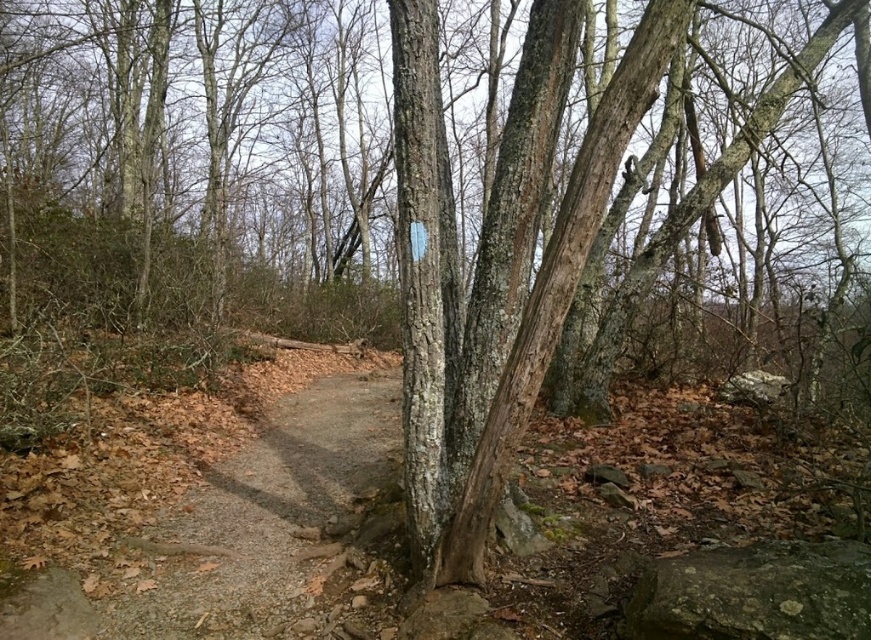
Question: Can you confirm if dirt/gravel path at center is wider than gray rough rock at lower right?

Choices:
 (A) yes
 (B) no

Answer: (A)

Question: Which point is farther to the camera?

Choices:
 (A) smooth bark tree at center
 (B) dirt/gravel path at center
 (C) gray rough rock at lower right

Answer: (B)

Question: Which object appears closest to the camera in this image?

Choices:
 (A) dirt/gravel path at center
 (B) gray rough rock at lower right
 (C) smooth bark tree at center

Answer: (B)

Question: Can you confirm if smooth bark tree at center is thinner than gray rough rock at lower right?

Choices:
 (A) yes
 (B) no

Answer: (B)

Question: Can you confirm if dirt/gravel path at center is positioned to the right of gray rough rock at lower right?

Choices:
 (A) yes
 (B) no

Answer: (B)

Question: Which object is closer to the camera taking this photo?

Choices:
 (A) gray rough rock at lower right
 (B) dirt/gravel path at center

Answer: (A)